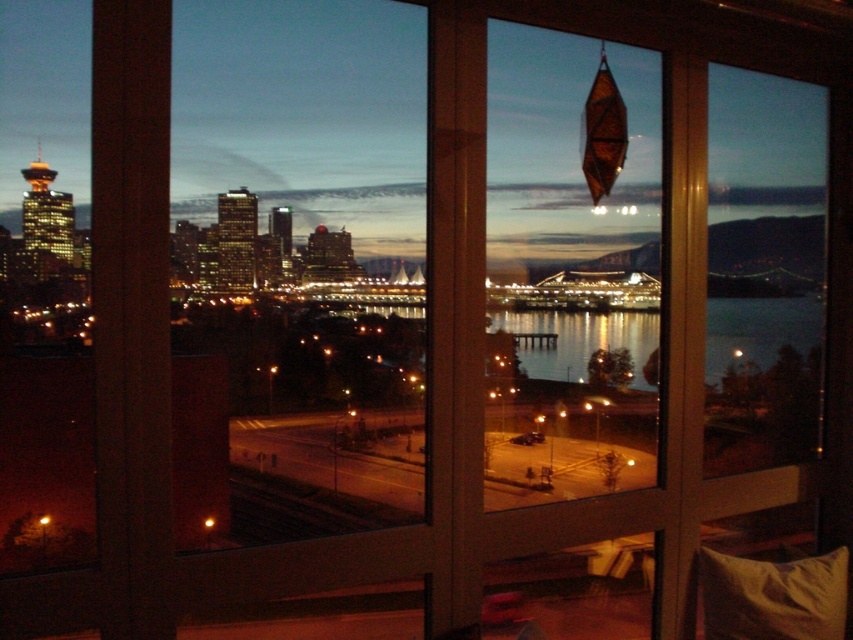
Question: Is reflective glass water at center bigger than soft beige pillow at lower right?

Choices:
 (A) yes
 (B) no

Answer: (A)

Question: Considering the relative positions of reflective glass water at center and soft beige pillow at lower right in the image provided, where is reflective glass water at center located with respect to soft beige pillow at lower right?

Choices:
 (A) left
 (B) right

Answer: (A)

Question: Is reflective glass water at center to the left of soft beige pillow at lower right from the viewer's perspective?

Choices:
 (A) yes
 (B) no

Answer: (A)

Question: Which object appears farthest from the camera in this image?

Choices:
 (A) reflective glass water at center
 (B) soft beige pillow at lower right

Answer: (B)